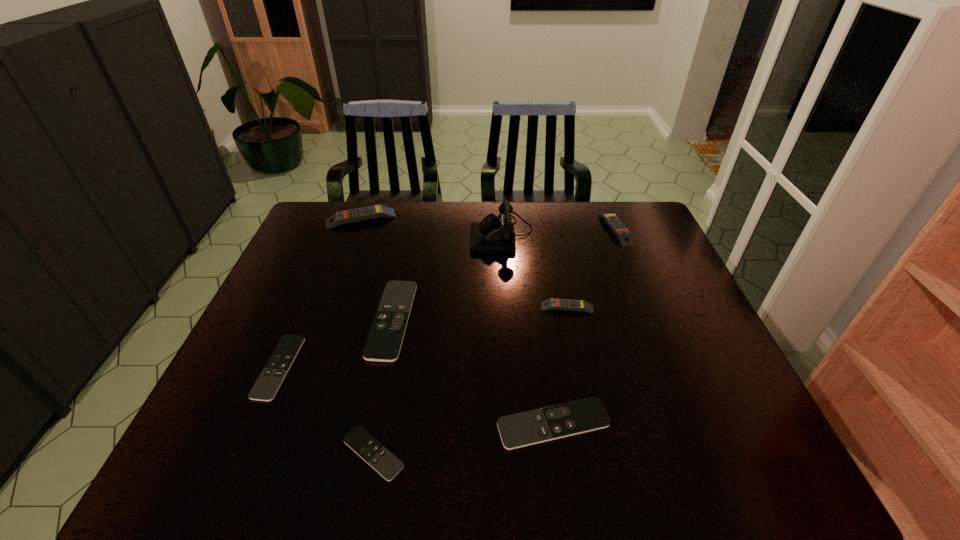
Locate an element on the screen. free space located 0.130m on the front of the third tallest remote control is located at coordinates (576, 350).

Image resolution: width=960 pixels, height=540 pixels. I want to click on vacant position located on the back of the fourth tallest remote control, so click(x=414, y=218).

Image resolution: width=960 pixels, height=540 pixels. Find the location of `free spot located on the left of the rightmost black remote control`. free spot located on the left of the rightmost black remote control is located at coordinates (381, 424).

Where is `free location located 0.320m on the right of the second smallest black remote control`? free location located 0.320m on the right of the second smallest black remote control is located at coordinates (427, 367).

You are a GUI agent. You are given a task and a screenshot of the screen. Output one action in this format:
    pyautogui.click(x=<x>, y=<y>)
    Task: Click on the free location located 0.090m on the right of the shortest remote control
    
    Given the screenshot: What is the action you would take?
    pyautogui.click(x=449, y=454)

This screenshot has height=540, width=960. What are the coordinates of `telephone located at the far edge` in the screenshot? It's located at (493, 235).

Find the location of a particular element. The width and height of the screenshot is (960, 540). object that is positioned at the right edge is located at coordinates (624, 236).

Where is `object that is at the far left corner`? This screenshot has width=960, height=540. object that is at the far left corner is located at coordinates click(x=376, y=211).

At what (x,y) coordinates should I click in order to perform the action: click on object located in the far right corner section of the desktop. Please return your answer as a coordinate pair (x, y). The width and height of the screenshot is (960, 540). Looking at the image, I should click on (624, 236).

This screenshot has height=540, width=960. In the image, there is a desktop. What are the coordinates of `vacant space at the far edge` in the screenshot? It's located at tap(552, 235).